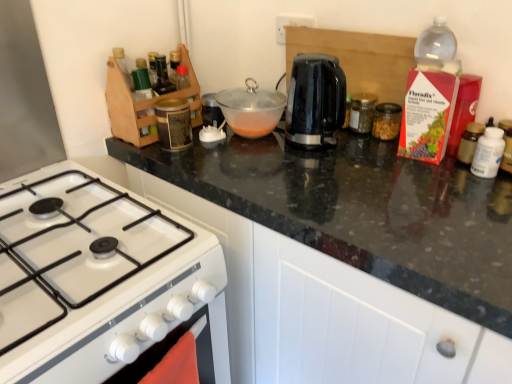
Question: Considering the positions of point (392, 206) and point (230, 97), is point (392, 206) closer or farther from the camera than point (230, 97)?

Choices:
 (A) farther
 (B) closer

Answer: (B)

Question: Is black granite countertop at upper center in front of or behind transparent glass bowl at center, arranged as the 5th kitchen appliance when viewed from the right, in the image?

Choices:
 (A) front
 (B) behind

Answer: (A)

Question: Which is farther from the translucent plastic bottle at right, which is the 5th kitchen appliance from left to right?

Choices:
 (A) black glossy electric kettle at center, which ranks as the 2th kitchen appliance in left-to-right order
 (B) white glossy gas stove at lower left
 (C) clear glass jar at center, which ranks as the 3th kitchen appliance in left-to-right order
 (D) black granite countertop at upper center
 (E) clear glass jar at center-right, placed as the second kitchen appliance when sorted from right to left

Answer: (B)

Question: Estimate the real-world distances between objects in this image. Which object is closer to the black granite countertop at upper center?

Choices:
 (A) black glossy electric kettle at center, which ranks as the 2th kitchen appliance in left-to-right order
 (B) white glossy gas stove at lower left
 (C) transparent glass bowl at center, arranged as the 5th kitchen appliance when viewed from the right
 (D) clear glass jar at center, which is the third kitchen appliance in right-to-left order
 (E) clear glass jar at center-right, placed as the second kitchen appliance when sorted from right to left

Answer: (A)